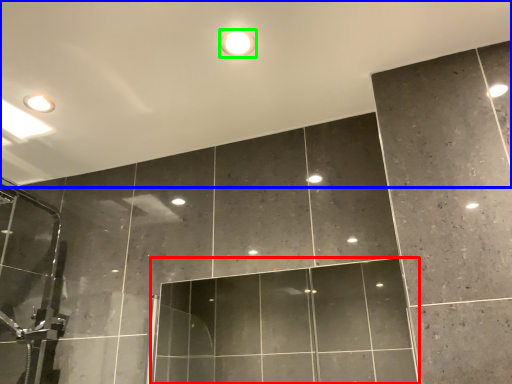
Question: Which object is positioned farthest from glass door (highlighted by a red box)? Select from backdrop (highlighted by a blue box) and droplight (highlighted by a green box).

Choices:
 (A) backdrop
 (B) droplight

Answer: (B)